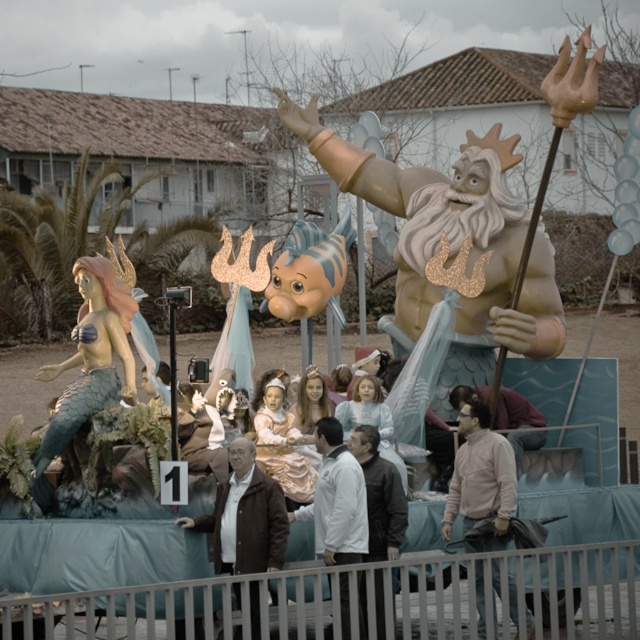
You are a photographer at the parade. You want to take a photo of the light pink fabric jacket at center without the gold metallic trident at upper center blocking it. How should you adjust your position?

Move to the side so that the light pink fabric jacket at center is no longer behind the gold metallic trident at upper center.

You are a photographer standing in front of the float and you want to take a photo of both the brown leather jacket at center and the light pink fabric jacket at center. Which jacket will appear closer to you in the photo?

The brown leather jacket at center will appear closer to you in the photo because it is further to the viewer than the light pink fabric jacket at center.